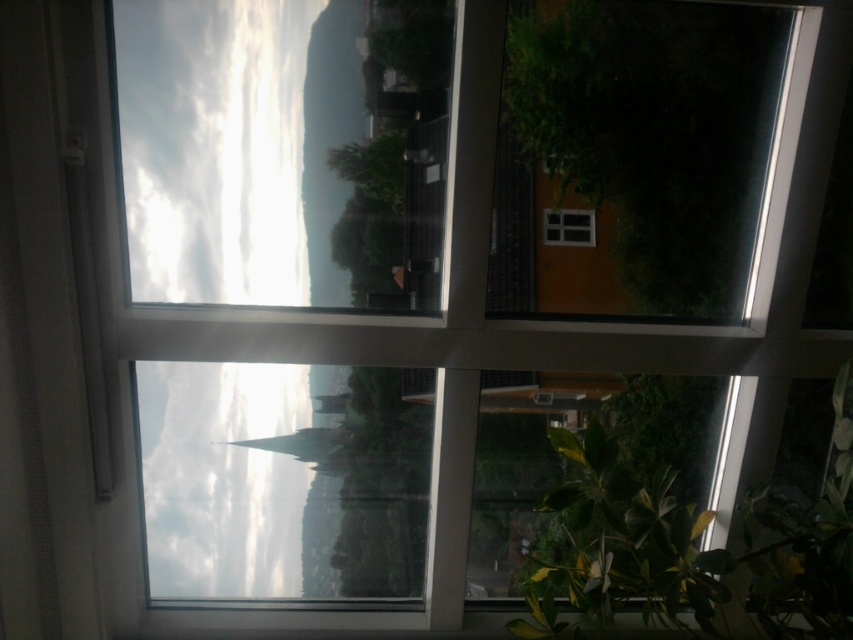
You are trying to move a large painting that is 1.5 meters wide from the wall to another room. The clear glass window at center is in your path. Can you move the painting through the space next to the green leafy plant at lower right without bending it?

The green leafy plant at lower right might be wider than clear glass window at center, so there is a possibility that the space next to the green leafy plant at lower right is narrower than 1.5 meters. Therefore, moving the painting through that space might not be possible without bending it.

Looking at this image, you are standing in a room looking through a window divided into four panes. There is a leafy plant nearby. You want to reach a point marked at coordinates point (619, 563) outside through the window. Considering the distance, can you safely step through the window to that point?

The distance between point (619, 563) and the camera is 2.17 meters. However, stepping through the window is not possible as windows are barriers and you cannot physically move through them.

You are standing in the room looking through the window. There are two points marked on the window pane, one at point coordinates point (641, 492) and another at point coordinates point (563, 218). Which point is closer to you?

Point (641, 492) is closer to the camera than point (563, 218), so the point at coordinates point (641, 492) is closer to you.